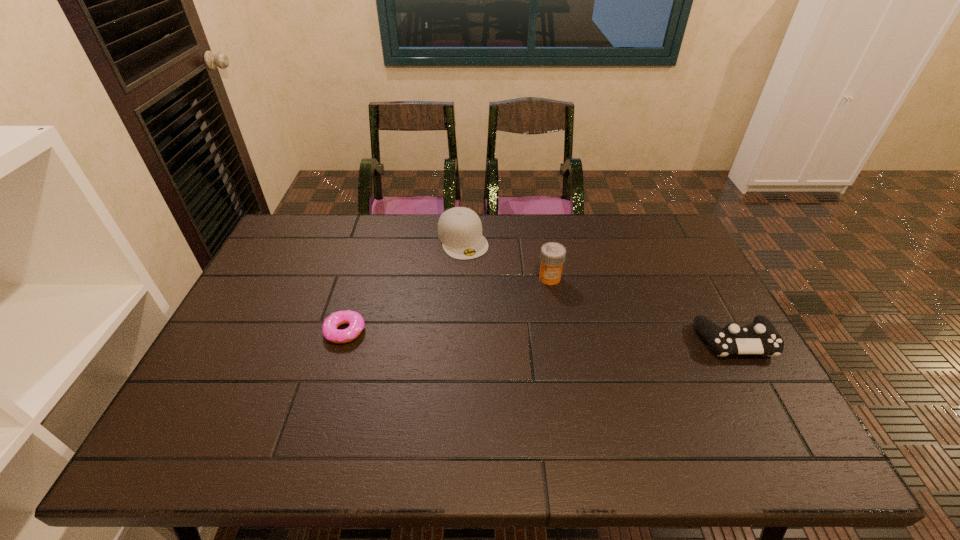
This screenshot has width=960, height=540. Find the location of `vacant area that lies between the cap and the control`. vacant area that lies between the cap and the control is located at coordinates (599, 291).

The height and width of the screenshot is (540, 960). Identify the location of vacant space in between the doughnut and the third object from right to left. (404, 285).

At what (x,y) coordinates should I click in order to perform the action: click on free space between the cap and the doughnut. Please return your answer as a coordinate pair (x, y). Looking at the image, I should click on (404, 285).

Choose which object is the second nearest neighbor to the farthest object. Please provide its 2D coordinates. Your answer should be formatted as a tuple, i.e. [(x, y)], where the tuple contains the x and y coordinates of a point satisfying the conditions above.

[(356, 323)]

The width and height of the screenshot is (960, 540). In order to click on object that is the closest one to the control in this screenshot , I will do `click(552, 256)`.

At what (x,y) coordinates should I click in order to perform the action: click on free space that satisfies the following two spatial constraints: 1. on the back side of the tallest object; 2. on the right side of the leftmost object. Please return your answer as a coordinate pair (x, y). The height and width of the screenshot is (540, 960). Looking at the image, I should click on (361, 278).